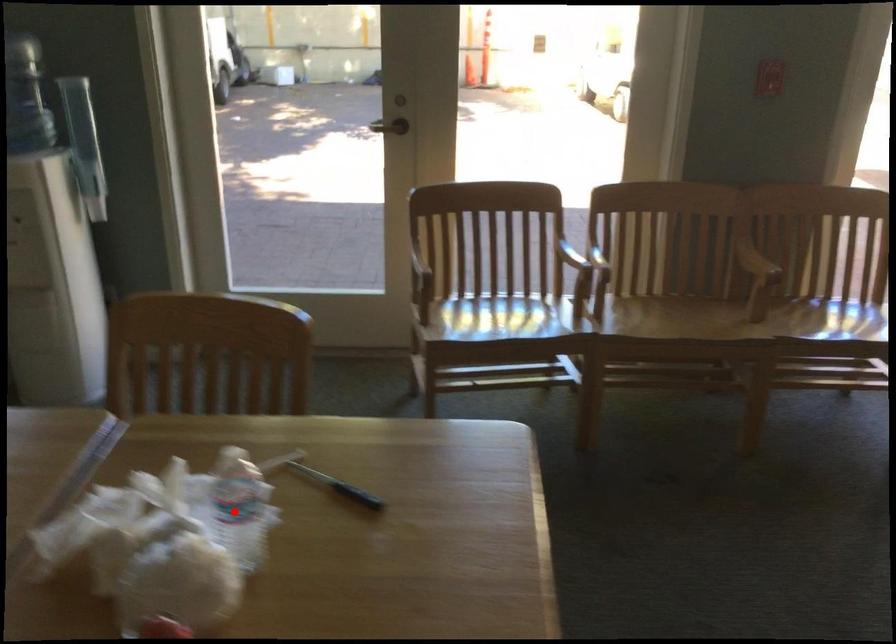
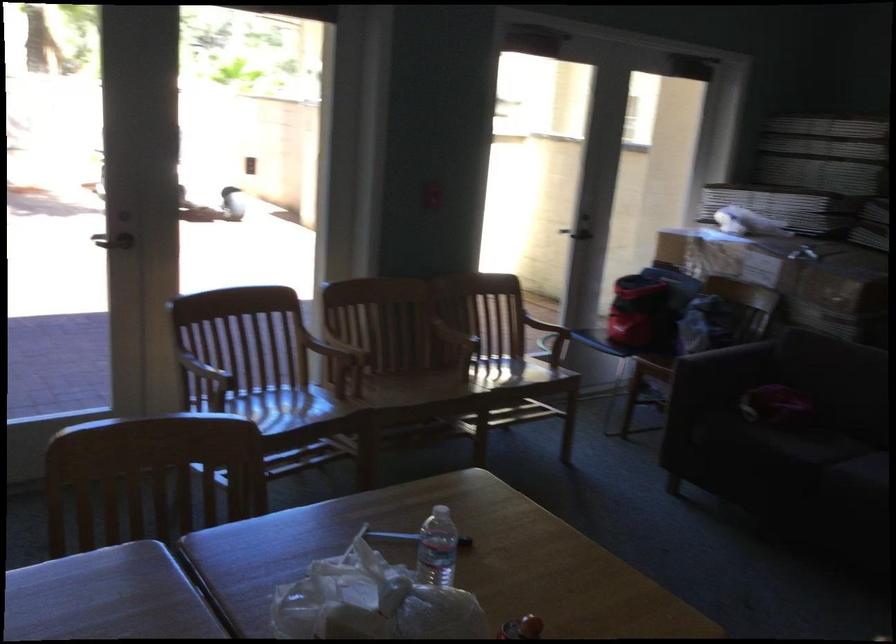
In the second image, find the point that corresponds to the highlighted location in the first image.

(437, 547)